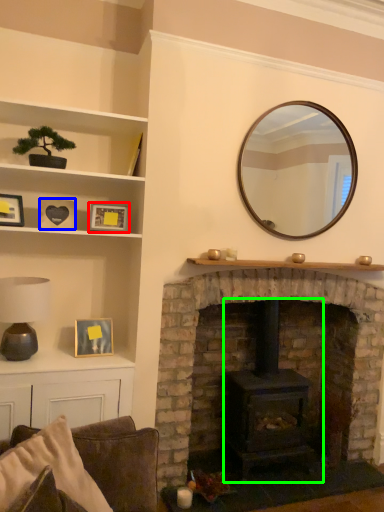
Question: Based on their relative distances, which object is nearer to picture frame (highlighted by a red box)? Choose from picture frame (highlighted by a blue box) and wood burning stove (highlighted by a green box).

Choices:
 (A) picture frame
 (B) wood burning stove

Answer: (A)